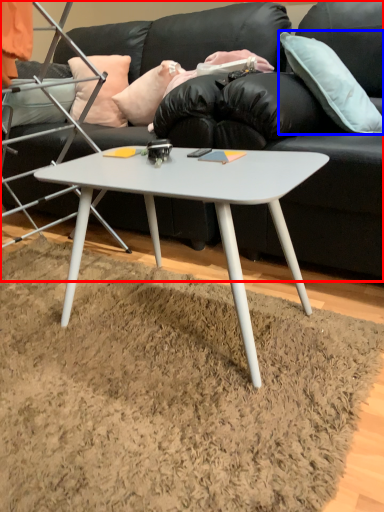
Question: Among these objects, which one is farthest to the camera, studio couch (highlighted by a red box) or pillow (highlighted by a blue box)?

Choices:
 (A) studio couch
 (B) pillow

Answer: (A)